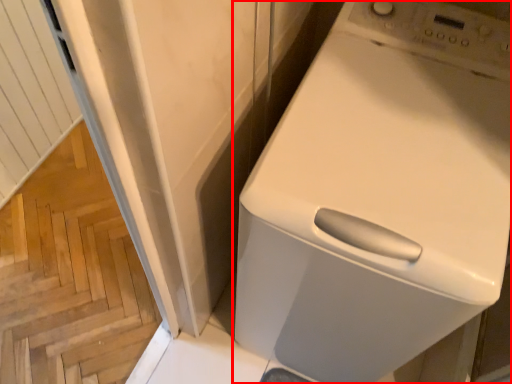
Question: From the image's perspective, what is the correct spatial relationship of home appliance (annotated by the red box) in relation to stairwell?

Choices:
 (A) above
 (B) below

Answer: (A)